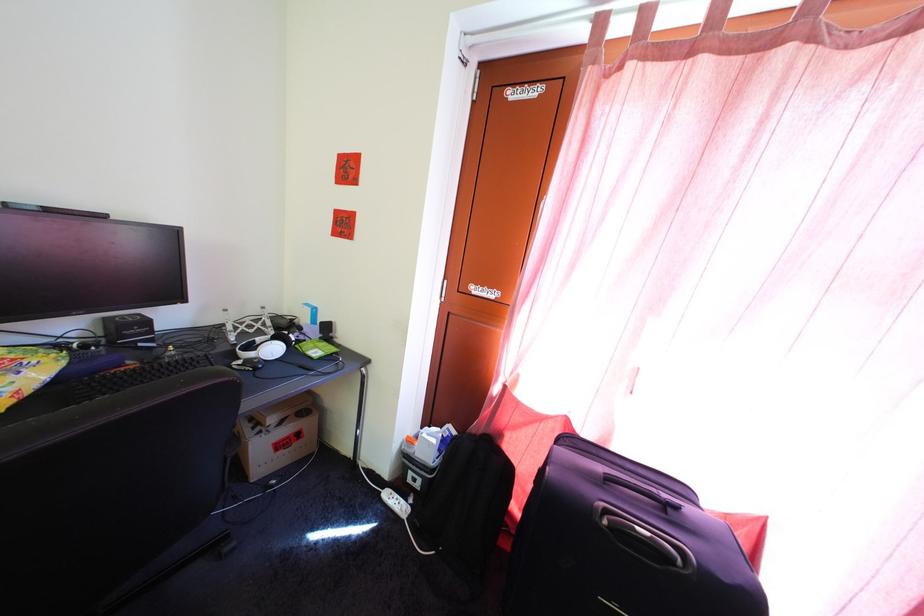
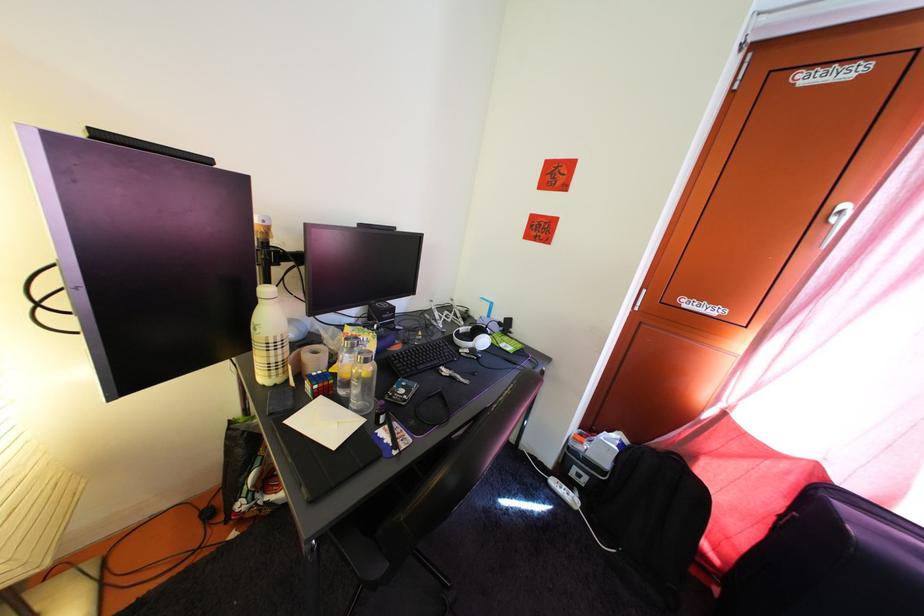
Question: The camera is either moving clockwise (left) or counter-clockwise (right) around the object. The first image is from the beginning of the video and the second image is from the end. Is the camera moving left or right when shooting the video?

Choices:
 (A) Left
 (B) Right

Answer: (B)